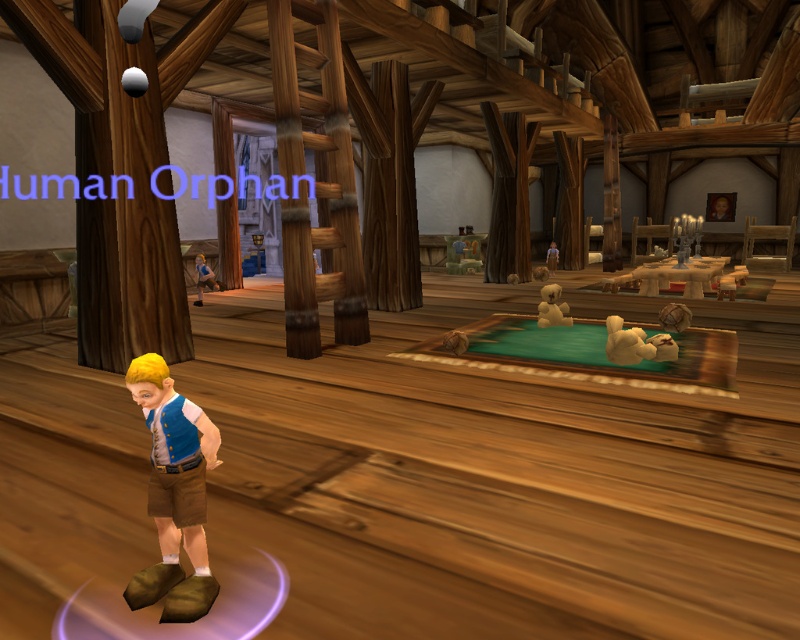
Based on the photo, you are a character in a fantasy game and you see a matte blue vest at lower left and a white plush bear at center. Which item is narrower in width?

The matte blue vest at lower left is thinner than the white plush bear at center, so the matte blue vest at lower left is narrower in width.

You are a character in a video game and need to locate your inventory. Your inventory is represented by the matte blue vest at lower left. Where on the screen should you look to find it?

The matte blue vest at lower left is located at point (173, 493) on the screen.

You are a character in the game who wants to pick up the white plush bear at center. Which direction should you move from the matte blue vest at lower left to reach it?

The white plush bear at center is to the right of the matte blue vest at lower left, so you should move to the right to reach it.